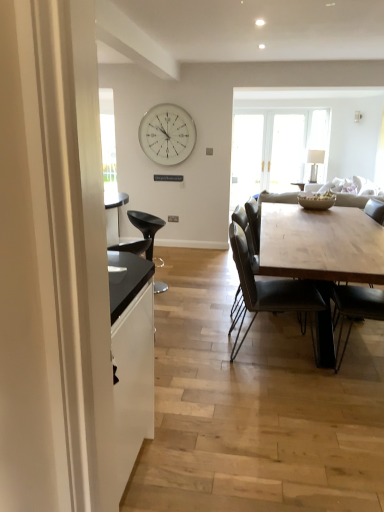
Question: Would you say leather couch at center is part of natural wood table at center's contents?

Choices:
 (A) no
 (B) yes

Answer: (A)

Question: From a real-world perspective, is natural wood table at center over leather couch at center?

Choices:
 (A) yes
 (B) no

Answer: (B)

Question: Can you confirm if natural wood table at center is thinner than leather couch at center?

Choices:
 (A) no
 (B) yes

Answer: (B)

Question: Does natural wood table at center have a smaller size compared to leather couch at center?

Choices:
 (A) no
 (B) yes

Answer: (B)

Question: Is natural wood table at center touching leather couch at center?

Choices:
 (A) yes
 (B) no

Answer: (B)

Question: Is natural wood table at center situated inside white glass clock at upper center or outside?

Choices:
 (A) inside
 (B) outside

Answer: (B)

Question: Is natural wood table at center taller or shorter than white glass clock at upper center?

Choices:
 (A) tall
 (B) short

Answer: (B)

Question: Is natural wood table at center in front of or behind white glass clock at upper center in the image?

Choices:
 (A) front
 (B) behind

Answer: (A)

Question: Considering the relative positions of natural wood table at center and white glass clock at upper center in the image provided, is natural wood table at center to the left or to the right of white glass clock at upper center?

Choices:
 (A) left
 (B) right

Answer: (B)

Question: From a real-world perspective, is dark gray leather chair at center, marked as the second chair in a back-to-front arrangement, positioned above or below leather couch at center?

Choices:
 (A) below
 (B) above

Answer: (A)

Question: From the image's perspective, is dark gray leather chair at center, the second chair in the front-to-back sequence, above or below leather couch at center?

Choices:
 (A) below
 (B) above

Answer: (A)

Question: Considering the positions of dark gray leather chair at center, the second chair positioned from the right, and leather couch at center in the image, is dark gray leather chair at center, the second chair positioned from the right, wider or thinner than leather couch at center?

Choices:
 (A) thin
 (B) wide

Answer: (A)

Question: In the image, is dark gray leather chair at center, the second chair positioned from the right, positioned in front of or behind leather couch at center?

Choices:
 (A) behind
 (B) front

Answer: (B)

Question: From a real-world perspective, relative to clear glass table lamp at upper right, is leather couch at center vertically above or below?

Choices:
 (A) above
 (B) below

Answer: (B)

Question: From the image's perspective, is leather couch at center located above or below clear glass table lamp at upper right?

Choices:
 (A) above
 (B) below

Answer: (B)